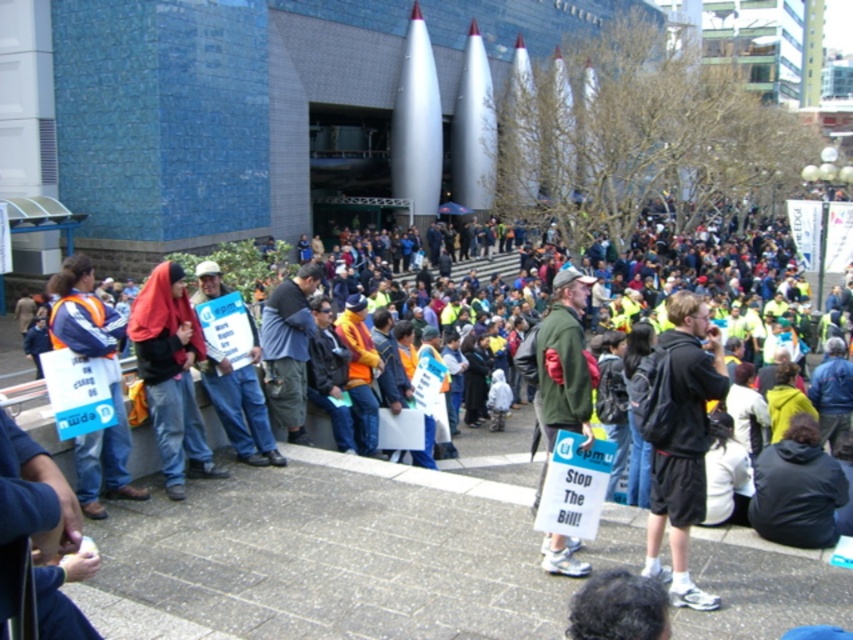
Measure the distance from orange safety vest at left to green fabric jacket at center.

They are 21.87 feet apart.

Can you confirm if orange safety vest at left is wider than green fabric jacket at center?

Yes, orange safety vest at left is wider than green fabric jacket at center.

This screenshot has width=853, height=640. I want to click on orange safety vest at left, so click(x=109, y=381).

Which is behind, point (570, 353) or point (210, 356)?

The point (210, 356) is more distant.

In the scene shown: Does green fabric jacket at center have a greater height compared to orange safety vest at center?

Indeed, green fabric jacket at center has a greater height compared to orange safety vest at center.

The height and width of the screenshot is (640, 853). Identify the location of green fabric jacket at center. (566, 360).

Can you confirm if red fabric headscarf at center is positioned above orange safety vest at center?

No.

Is point (192, 432) closer to camera compared to point (206, 358)?

That is True.

This screenshot has width=853, height=640. Find the location of `red fabric headscarf at center`. red fabric headscarf at center is located at coordinates (171, 376).